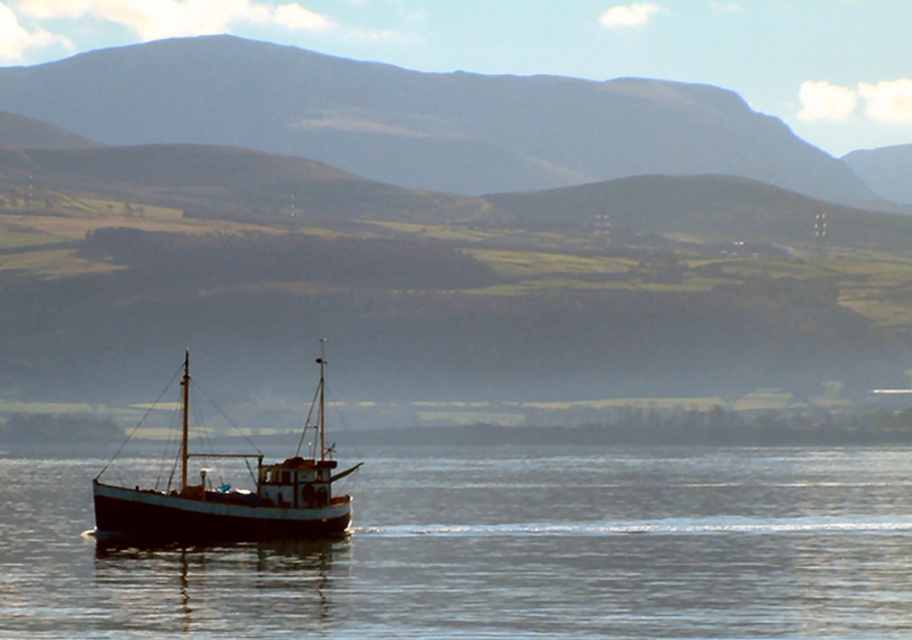
Question: Is the position of smooth water at center more distant than that of white matte boat at lower left?

Choices:
 (A) yes
 (B) no

Answer: (B)

Question: Which object is closer to the camera taking this photo?

Choices:
 (A) white matte boat at lower left
 (B) smooth water at center

Answer: (B)

Question: Can you confirm if gray rocky mountain at upper center is positioned below white matte boat at lower left?

Choices:
 (A) yes
 (B) no

Answer: (B)

Question: Which point is closer to the camera taking this photo?

Choices:
 (A) (151, 493)
 (B) (157, 561)
 (C) (420, 177)

Answer: (B)

Question: Which object is farther from the camera taking this photo?

Choices:
 (A) gray rocky mountain at upper center
 (B) white matte boat at lower left

Answer: (A)

Question: Does gray rocky mountain at upper center appear on the left side of white matte boat at lower left?

Choices:
 (A) yes
 (B) no

Answer: (B)